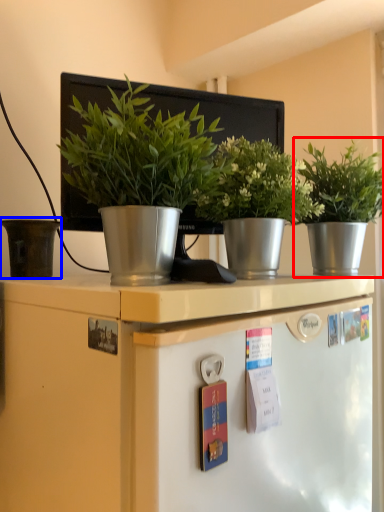
Question: Which of the following is the closest to the observer, houseplant (highlighted by a red box) or flowerpot (highlighted by a blue box)?

Choices:
 (A) houseplant
 (B) flowerpot

Answer: (A)